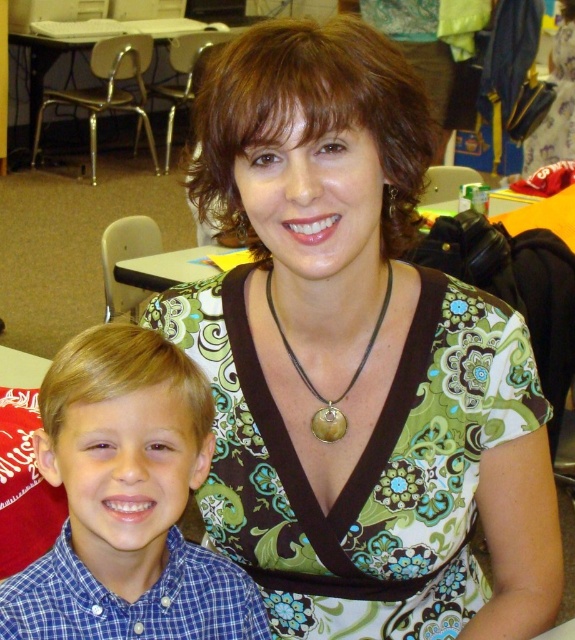
You are an interior designer assessing the layout of this classroom. You notice the metallic silver table at upper left and the leather cord pendant at center. Which object is positioned closer to the front of the room from your perspective?

The metallic silver table at upper left is closer to the front of the room because the leather cord pendant at center is behind it.

Based on the coordinates provided, which object in the scene is located at point (356, 362)?

The green patterned blouse at center is located at point (356, 362).

You are a photographer setting up for a group photo. You notice the green patterned blouse at center and the blue checkered shirt at lower left in the frame. Which of these two items would appear bigger in the photo?

The green patterned blouse at center appears bigger in the photo because it is larger in size than the blue checkered shirt at lower left.